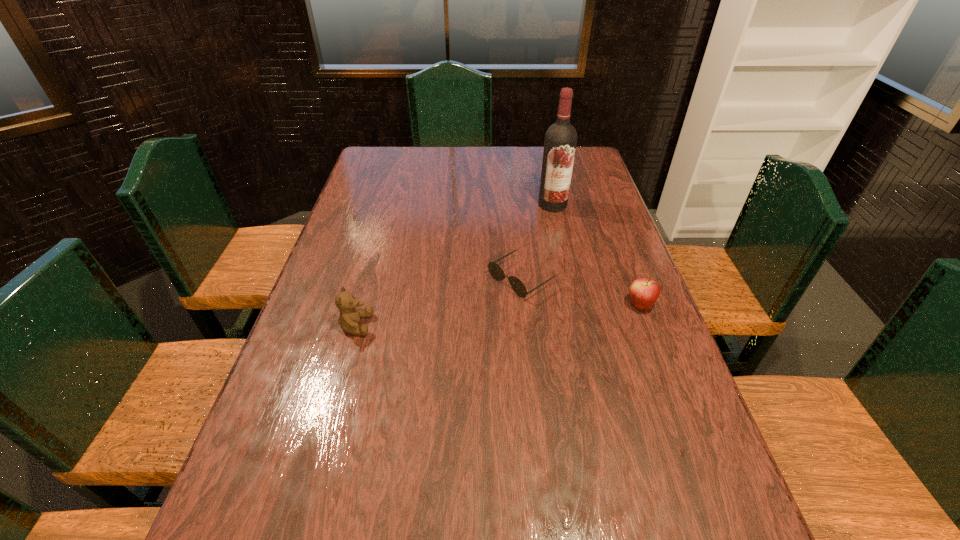
At what (x,y) coordinates should I click in order to perform the action: click on the leftmost object. Please return your answer as a coordinate pair (x, y). The width and height of the screenshot is (960, 540). Looking at the image, I should click on (349, 318).

Find the location of a particular element. Image resolution: width=960 pixels, height=540 pixels. apple is located at coordinates (644, 292).

The height and width of the screenshot is (540, 960). In order to click on the farthest object in this screenshot , I will do `click(560, 142)`.

This screenshot has width=960, height=540. Identify the location of the tallest object. (560, 142).

The image size is (960, 540). What are the coordinates of `the shortest object` in the screenshot? It's located at (497, 273).

This screenshot has height=540, width=960. I want to click on free space located 0.320m on the front-facing side of the teddy bear, so pyautogui.click(x=498, y=325).

Where is `vacant space located 0.280m on the left of the apple`? vacant space located 0.280m on the left of the apple is located at coordinates (520, 305).

Where is `free space located 0.310m on the label of the tallest object`? This screenshot has width=960, height=540. free space located 0.310m on the label of the tallest object is located at coordinates (545, 272).

Where is `free location located on the label of the tallest object`? The image size is (960, 540). free location located on the label of the tallest object is located at coordinates (547, 251).

The image size is (960, 540). I want to click on vacant space located on the label of the tallest object, so click(x=551, y=221).